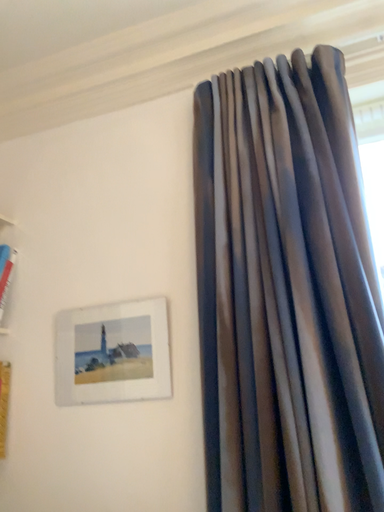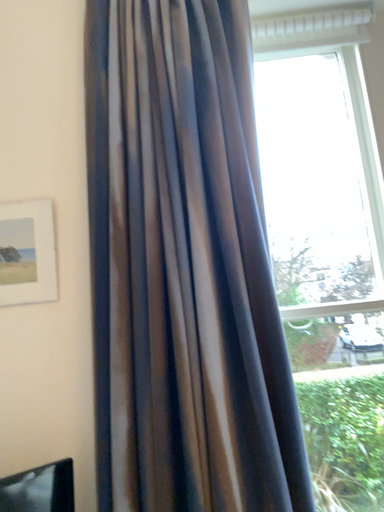
Question: How did the camera likely rotate when shooting the video?

Choices:
 (A) rotated left
 (B) rotated right

Answer: (B)